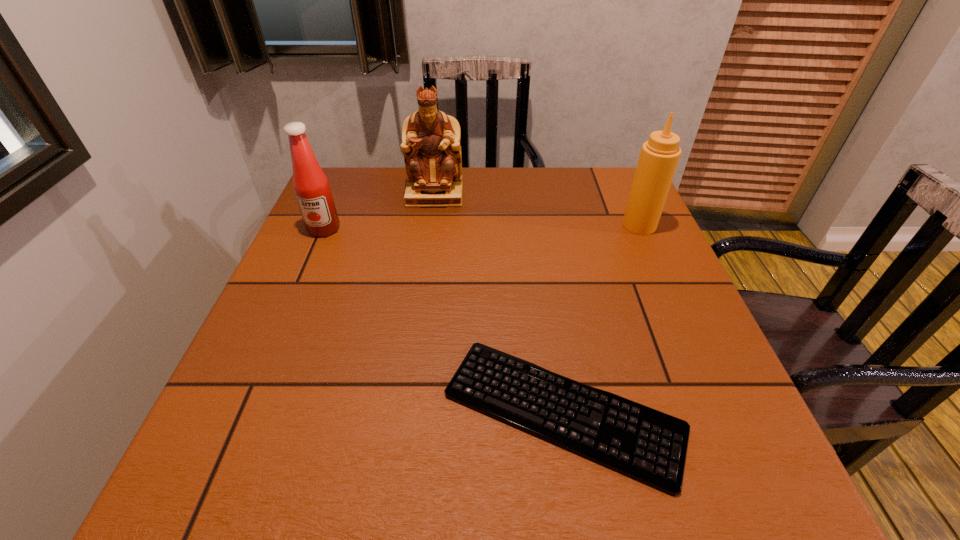
This screenshot has width=960, height=540. In the image, there is a desktop. In order to click on free space at the far right corner in this screenshot , I will do `click(629, 185)`.

Identify the location of free area in between the rightmost object and the figurine. This screenshot has width=960, height=540. (537, 210).

I want to click on unoccupied area between the rightmost object and the figurine, so click(x=537, y=210).

This screenshot has width=960, height=540. I want to click on free space between the shortest object and the left condiment, so click(x=444, y=320).

Image resolution: width=960 pixels, height=540 pixels. In order to click on free spot between the left condiment and the figurine in this screenshot , I will do `click(379, 212)`.

Locate an element on the screen. This screenshot has height=540, width=960. vacant space that is in between the nearest object and the right condiment is located at coordinates (601, 318).

Where is `empty space that is in between the figurine and the right condiment`? The width and height of the screenshot is (960, 540). empty space that is in between the figurine and the right condiment is located at coordinates (537, 210).

Where is `free space between the figurine and the right condiment`? Image resolution: width=960 pixels, height=540 pixels. free space between the figurine and the right condiment is located at coordinates (537, 210).

Locate an element on the screen. free spot between the farthest object and the left condiment is located at coordinates (379, 212).

This screenshot has width=960, height=540. Identify the location of free space between the farthest object and the right condiment. (537, 210).